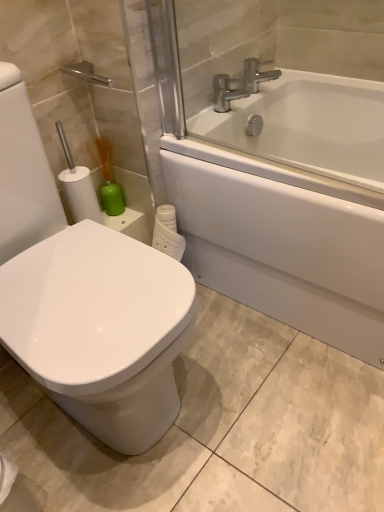
You are a GUI agent. You are given a task and a screenshot of the screen. Output one action in this format:
    pyautogui.click(x=<x>, y=<y>)
    Task: Click on the silver metallic faucet at upper center
    The height and width of the screenshot is (512, 384).
    Given the screenshot: What is the action you would take?
    pos(227,91)

The image size is (384, 512). What do you see at coordinates (100, 329) in the screenshot?
I see `white glossy bidet at left` at bounding box center [100, 329].

Locate an element on the screen. Image resolution: width=384 pixels, height=512 pixels. green matte soap dispenser at left is located at coordinates [109, 180].

This screenshot has height=512, width=384. Describe the element at coordinates (291, 206) in the screenshot. I see `white glossy bathtub at upper right` at that location.

This screenshot has height=512, width=384. Find the location of `silver metallic faucet at upper center`. silver metallic faucet at upper center is located at coordinates (227, 91).

Is silver metallic faucet at upper center positioned with its back to silver metallic faucet at upper center?

No.

Does silver metallic faucet at upper center come in front of silver metallic faucet at upper center?

Yes, it is.

From a real-world perspective, which object stands above the other?

silver metallic faucet at upper center is physically above.

Which of these two, silver metallic faucet at upper center or silver metallic faucet at upper center, stands shorter?

Standing shorter between the two is silver metallic faucet at upper center.

From a real-world perspective, is green matte soap dispenser at left under silver metallic faucet at upper center?

Yes, from a real-world perspective, green matte soap dispenser at left is under silver metallic faucet at upper center.

Is green matte soap dispenser at left turned away from silver metallic faucet at upper center?

green matte soap dispenser at left is not turned away from silver metallic faucet at upper center.

Are green matte soap dispenser at left and silver metallic faucet at upper center beside each other?

No, green matte soap dispenser at left is not in contact with silver metallic faucet at upper center.

Looking at this image, considering the sizes of green matte soap dispenser at left and silver metallic faucet at upper center in the image, is green matte soap dispenser at left taller or shorter than silver metallic faucet at upper center?

In the image, green matte soap dispenser at left appears to be taller than silver metallic faucet at upper center.

Which point is more distant from viewer, (277,74) or (104,294)?

The point (277,74) is farther from the camera.

Identify the location of tap that appears above the white glossy bidet at left (from the image's perspective). (256, 75).

From a real-world perspective, is silver metallic faucet at upper center physically above white glossy bidet at left?

Yes, from a real-world perspective, silver metallic faucet at upper center is over white glossy bidet at left

In the image, is silver metallic faucet at upper center on the left side or the right side of white glossy bidet at left?

Based on their positions, silver metallic faucet at upper center is located to the right of white glossy bidet at left.

From a real-world perspective, relative to white glossy bidet at left, is silver metallic faucet at upper center vertically above or below?

Clearly, from a real-world perspective, silver metallic faucet at upper center is above white glossy bidet at left.

Is white glossy bidet at left located within silver metallic faucet at upper center?

No, white glossy bidet at left is not inside silver metallic faucet at upper center.

Find the location of `bidet below the silver metallic faucet at upper center (from the image's perspective)`. bidet below the silver metallic faucet at upper center (from the image's perspective) is located at coordinates (100, 329).

Consider the image. What's the angular difference between silver metallic faucet at upper center and white glossy bidet at left's facing directions?

The facing directions of silver metallic faucet at upper center and white glossy bidet at left are 0.252 degrees apart.

Is green matte soap dispenser at left at the left side of silver metallic faucet at upper center?

Yes, green matte soap dispenser at left is to the left of silver metallic faucet at upper center.

Measure the distance from green matte soap dispenser at left to silver metallic faucet at upper center.

A distance of 22.20 inches exists between green matte soap dispenser at left and silver metallic faucet at upper center.

From the image's perspective, which one is positioned higher, green matte soap dispenser at left or silver metallic faucet at upper center?

silver metallic faucet at upper center, from the image's perspective.

Which of these two, white glossy bidet at left or green matte soap dispenser at left, is thinner?

Thinner between the two is green matte soap dispenser at left.

Between white glossy bidet at left and green matte soap dispenser at left, which one appears on the right side from the viewer's perspective?

Positioned to the right is green matte soap dispenser at left.

In the scene shown: From the image's perspective, is white glossy bidet at left under green matte soap dispenser at left?

Yes, from the image's perspective, white glossy bidet at left is beneath green matte soap dispenser at left.

Is the surface of white glossy bidet at left in direct contact with green matte soap dispenser at left?

No.

Which object is positioned more to the right, white glossy bathtub at upper right or white glossy bidet at left?

white glossy bathtub at upper right.

Where is `bathtub below the white glossy bidet at left (from a real-world perspective)`? bathtub below the white glossy bidet at left (from a real-world perspective) is located at coordinates (291, 206).

Is white glossy bathtub at upper right oriented towards white glossy bidet at left?

Yes, white glossy bathtub at upper right faces towards white glossy bidet at left.

Is white glossy bathtub at upper right far from white glossy bidet at left?

No, white glossy bathtub at upper right is in close proximity to white glossy bidet at left.

Where is `tap located above the silver metallic faucet at upper center (from a real-world perspective)`? tap located above the silver metallic faucet at upper center (from a real-world perspective) is located at coordinates click(256, 75).

Find the location of a particular element. The image size is (384, 512). faucet on the right of green matte soap dispenser at left is located at coordinates (227, 91).

Estimate the real-world distances between objects in this image. Which object is closer to white glossy bidet at left, silver metallic faucet at upper center or green matte soap dispenser at left?

green matte soap dispenser at left lies closer to white glossy bidet at left than the other object.

Estimate the real-world distances between objects in this image. Which object is further from green matte soap dispenser at left, silver metallic faucet at upper center or silver metallic faucet at upper center?

silver metallic faucet at upper center lies further to green matte soap dispenser at left than the other object.

Which object lies further to the anchor point white glossy bidet at left, white glossy bathtub at upper right or silver metallic faucet at upper center?

silver metallic faucet at upper center.

From the image, which object appears to be nearer to white glossy bathtub at upper right, white glossy bidet at left or silver metallic faucet at upper center?

The object closer to white glossy bathtub at upper right is silver metallic faucet at upper center.

Which object lies nearer to the anchor point white glossy bathtub at upper right, green matte soap dispenser at left or silver metallic faucet at upper center?

silver metallic faucet at upper center is positioned closer to the anchor white glossy bathtub at upper right.

From the image, which object appears to be nearer to white glossy bidet at left, silver metallic faucet at upper center or white glossy bathtub at upper right?

The object closer to white glossy bidet at left is white glossy bathtub at upper right.

Looking at the image, which one is located closer to white glossy bidet at left, white glossy bathtub at upper right or silver metallic faucet at upper center?

white glossy bathtub at upper right is closer to white glossy bidet at left.

Considering their positions, is silver metallic faucet at upper center positioned closer to white glossy bathtub at upper right than white glossy bidet at left?

silver metallic faucet at upper center.

Locate an element on the screen. The width and height of the screenshot is (384, 512). soap dispenser situated between white glossy bidet at left and white glossy bathtub at upper right from left to right is located at coordinates (109, 180).

Where is `bathtub between white glossy bidet at left and silver metallic faucet at upper center from front to back`? Image resolution: width=384 pixels, height=512 pixels. bathtub between white glossy bidet at left and silver metallic faucet at upper center from front to back is located at coordinates (291, 206).

Find the location of `soap dispenser located between white glossy bidet at left and silver metallic faucet at upper center in the depth direction`. soap dispenser located between white glossy bidet at left and silver metallic faucet at upper center in the depth direction is located at coordinates (109, 180).

Locate an element on the screen. soap dispenser between white glossy bidet at left and silver metallic faucet at upper center in the front-back direction is located at coordinates (x=109, y=180).